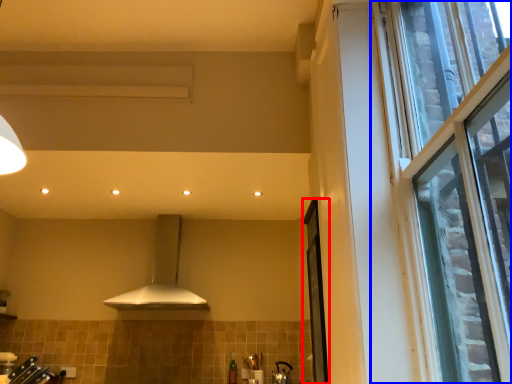
Question: Which of the following is the closest to the observer, screen door (highlighted by a red box) or window (highlighted by a blue box)?

Choices:
 (A) screen door
 (B) window

Answer: (B)